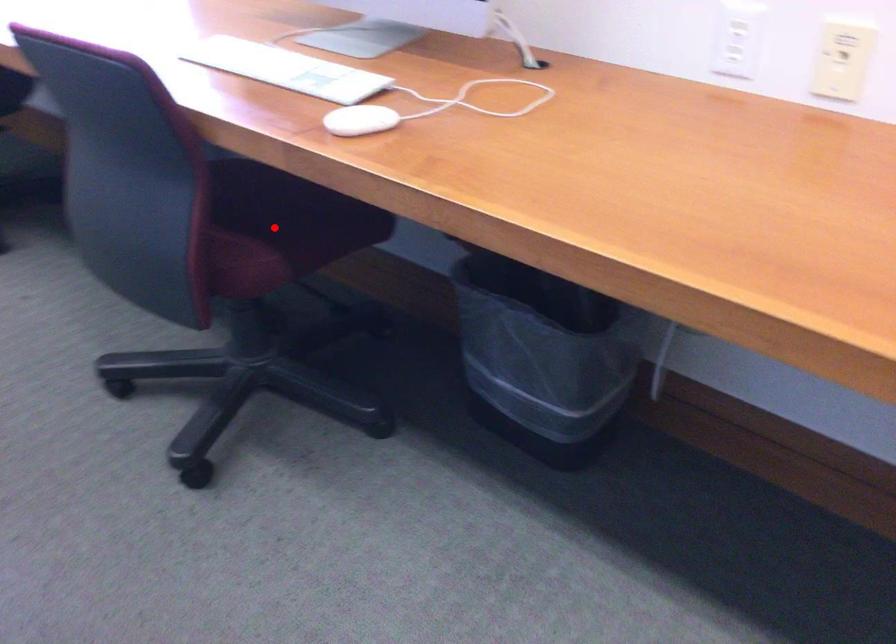
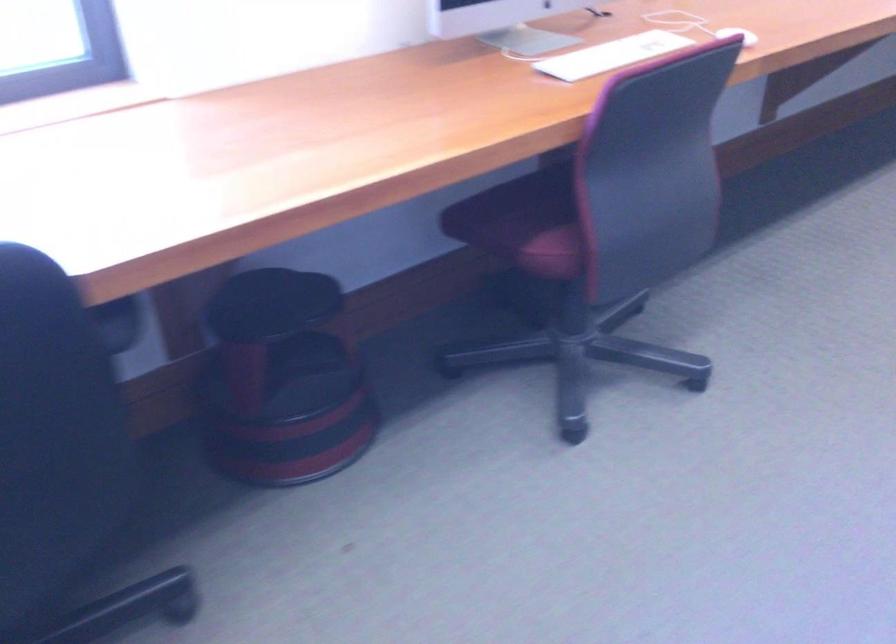
Question: I am providing you with two images of the same scene from different viewpoints. A red point is marked on the first image. Can you still see the location of the red point in image 2?

Choices:
 (A) Yes
 (B) No

Answer: (B)